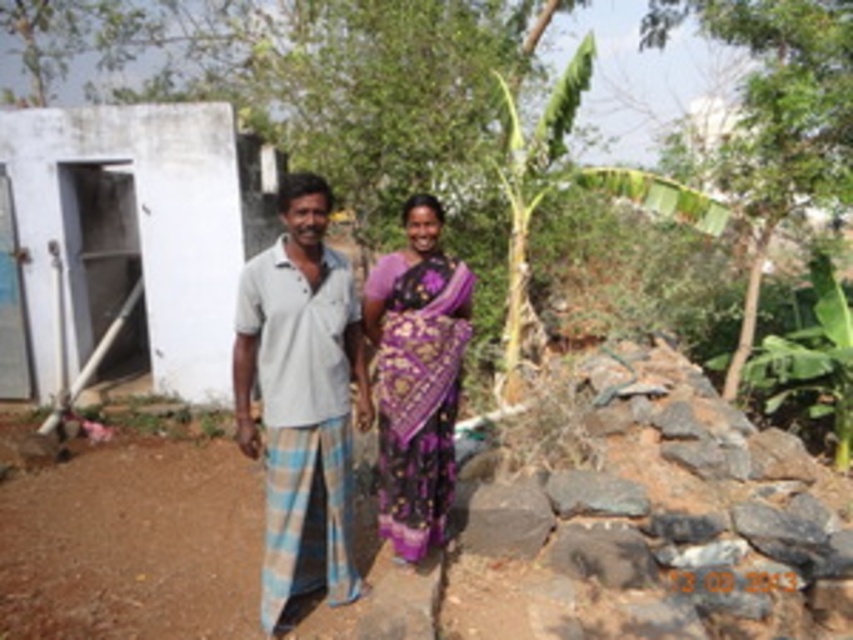
Between white concrete hut at left and green leafy tree at upper right, which one appears on the left side from the viewer's perspective?

white concrete hut at left

Who is more forward, (193, 362) or (816, 84)?

Point (816, 84)

Locate an element on the screen. The image size is (853, 640). white concrete hut at left is located at coordinates (134, 234).

Who is taller, green leafy tree at upper right or purple silk saree at center?

With more height is purple silk saree at center.

Between point (836, 92) and point (405, 262), which one is positioned behind?

Point (836, 92)

Is point (776, 99) farther from camera compared to point (415, 385)?

Yes, it is behind point (415, 385).

At what (x,y) coordinates should I click in order to perform the action: click on green leafy tree at upper right. Please return your answer as a coordinate pair (x, y). The image size is (853, 640). Looking at the image, I should click on (779, 112).

Which is more to the right, purple woven sari at center or green leafy banana tree at right?

green leafy banana tree at right is more to the right.

Is purple woven sari at center to the right of green leafy banana tree at right from the viewer's perspective?

Incorrect, purple woven sari at center is not on the right side of green leafy banana tree at right.

Is point (334, 362) more distant than point (515, 387)?

No, it is in front of (515, 387).

Where is `purple woven sari at center`? Image resolution: width=853 pixels, height=640 pixels. purple woven sari at center is located at coordinates (302, 400).